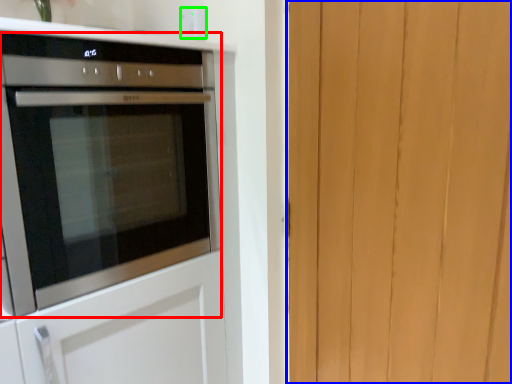
Question: Which is farther away from oven (highlighted by a red box)? barn door (highlighted by a blue box) or electric outlet (highlighted by a green box)?

Choices:
 (A) barn door
 (B) electric outlet

Answer: (A)